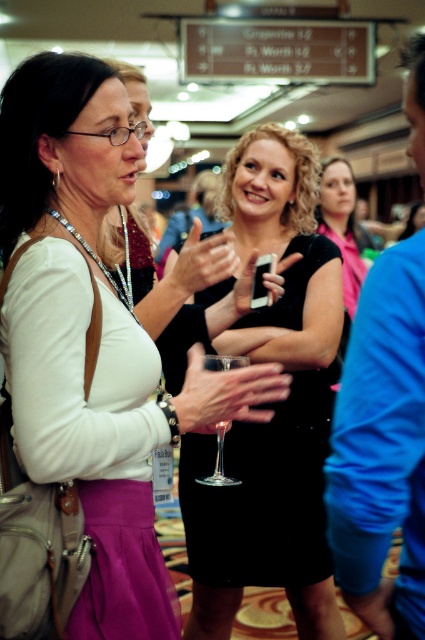
Can you confirm if black satin dress at center is smaller than black matte dress at center?

Incorrect, black satin dress at center is not smaller in size than black matte dress at center.

Where is `black satin dress at center`? This screenshot has width=425, height=640. black satin dress at center is located at coordinates (275, 408).

At what (x,y) coordinates should I click in order to perform the action: click on black satin dress at center. Please return your answer as a coordinate pair (x, y). This screenshot has width=425, height=640. Looking at the image, I should click on (275, 408).

Can you confirm if black matte dress at center is positioned to the left of clear glass wine glass at center?

No, black matte dress at center is not to the left of clear glass wine glass at center.

Can you confirm if black matte dress at center is positioned below clear glass wine glass at center?

No, black matte dress at center is not below clear glass wine glass at center.

What do you see at coordinates (340, 225) in the screenshot?
I see `black matte dress at center` at bounding box center [340, 225].

Find the location of `black matte dress at center`. black matte dress at center is located at coordinates (340, 225).

Based on the photo, can you confirm if white matte dress at center is positioned to the left of clear glass wine glass at center?

Yes, white matte dress at center is to the left of clear glass wine glass at center.

Is white matte dress at center shorter than clear glass wine glass at center?

Incorrect, white matte dress at center's height does not fall short of clear glass wine glass at center's.

The height and width of the screenshot is (640, 425). What do you see at coordinates (85, 371) in the screenshot?
I see `white matte dress at center` at bounding box center [85, 371].

The height and width of the screenshot is (640, 425). Find the location of `white matte dress at center`. white matte dress at center is located at coordinates (85, 371).